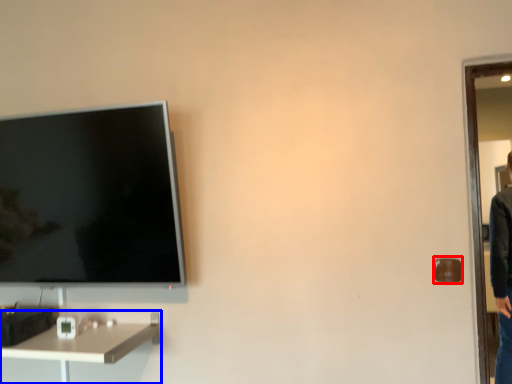
Question: Which of the following is the closest to the observer, door handle (highlighted by a red box) or desk (highlighted by a blue box)?

Choices:
 (A) door handle
 (B) desk

Answer: (B)